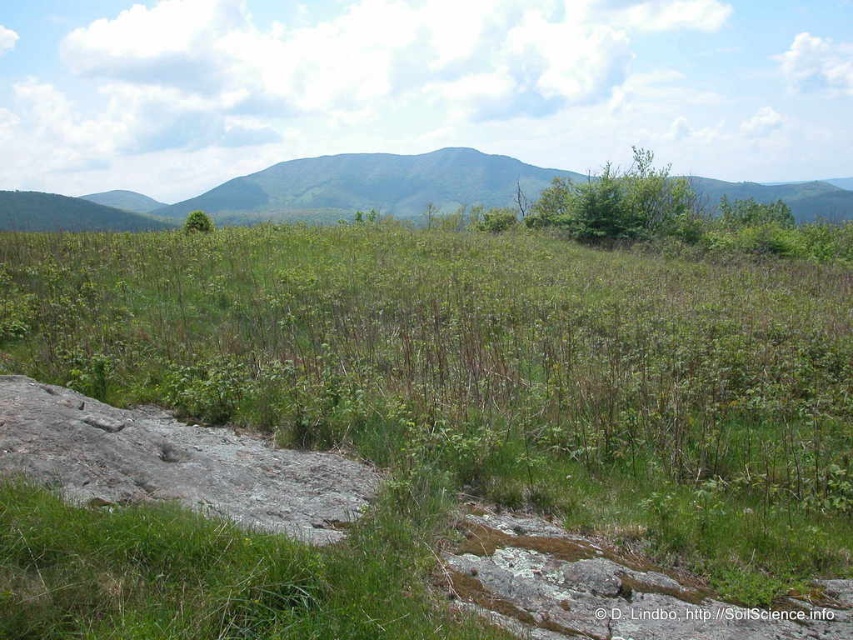
You are a hiker trying to cross this landscape. You need to step on the green grassy at center and the gray rough rock at lower left. Which surface will feel taller under your foot?

The green grassy at center is taller than the gray rough rock at lower left, so stepping on the green grassy at center will feel taller under your foot.

You are standing at the origin point of the image. You want to walk to the green grassy at center. Which direction should you move in to reach it?

The green grassy at center is located at point (485, 371), so you should move towards the coordinates (485, 371) to reach it.